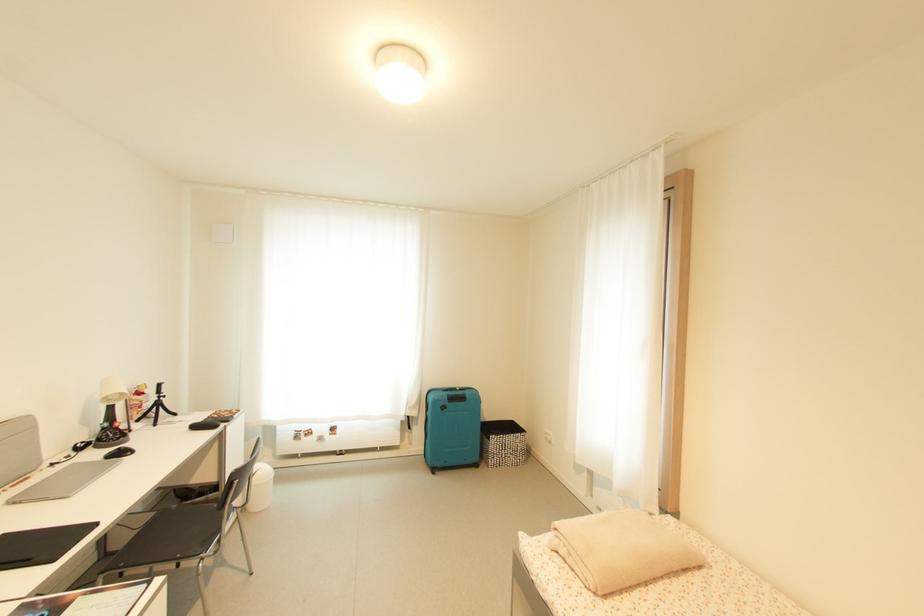
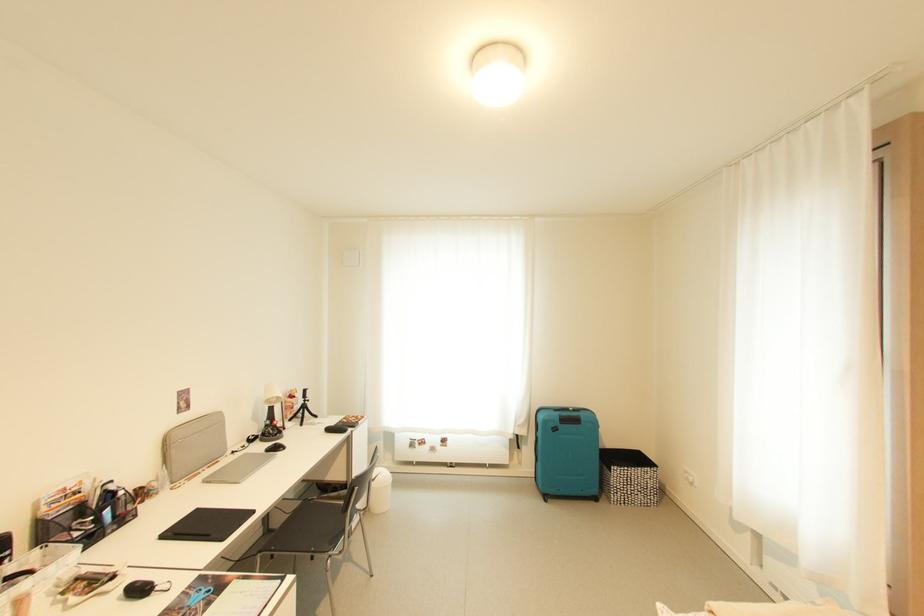
In the second image, find the point that corresponds to [463,390] in the first image.

(576, 411)